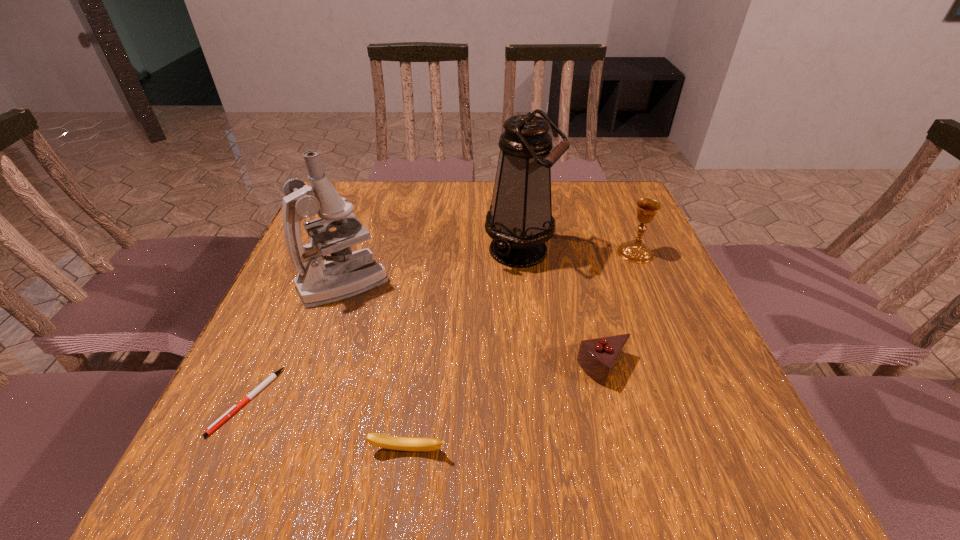
What are the coordinates of `empty space that is in between the third object from left to right and the microscope` in the screenshot? It's located at (376, 366).

Select which object appears as the fifth closest to the microscope. Please provide its 2D coordinates. Your answer should be formatted as a tuple, i.e. [(x, y)], where the tuple contains the x and y coordinates of a point satisfying the conditions above.

[(635, 251)]

At what (x,y) coordinates should I click in order to perform the action: click on the fourth closest object to the fourth tallest object. Please return your answer as a coordinate pair (x, y). Image resolution: width=960 pixels, height=540 pixels. Looking at the image, I should click on (345, 273).

This screenshot has width=960, height=540. Identify the location of free space that satisfies the following two spatial constraints: 1. on the back side of the fourth tallest object; 2. on the left side of the fourth shortest object. (574, 253).